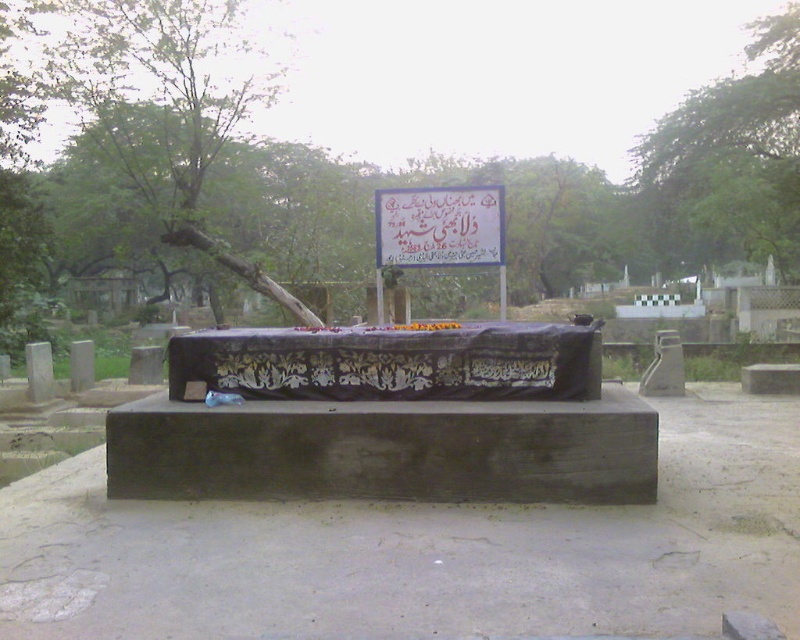
Between green leafy tree at left and white paper sign at center, which one has less height?

white paper sign at center is shorter.

Between green leafy tree at left and white paper sign at center, which one appears on the left side from the viewer's perspective?

green leafy tree at left is more to the left.

Which is behind, point (98, 129) or point (464, 225)?

Positioned behind is point (98, 129).

This screenshot has height=640, width=800. In order to click on green leafy tree at left in this screenshot , I will do `click(162, 106)`.

Which is below, green leafy tree at center or white paper sign at center?

white paper sign at center

Is green leafy tree at center positioned behind white paper sign at center?

Yes, it is behind white paper sign at center.

Identify the location of green leafy tree at center. This screenshot has width=800, height=640. (470, 70).

The width and height of the screenshot is (800, 640). What are the coordinates of `green leafy tree at center` in the screenshot? It's located at (470, 70).

Does green leafy tree at left have a larger size compared to green leafy tree at upper right?

Incorrect, green leafy tree at left is not larger than green leafy tree at upper right.

Is the position of green leafy tree at left less distant than that of green leafy tree at upper right?

That is True.

At what (x,y) coordinates should I click in order to perform the action: click on green leafy tree at left. Please return your answer as a coordinate pair (x, y). The height and width of the screenshot is (640, 800). Looking at the image, I should click on [x=162, y=106].

Where is `green leafy tree at left`? The height and width of the screenshot is (640, 800). green leafy tree at left is located at coordinates (162, 106).